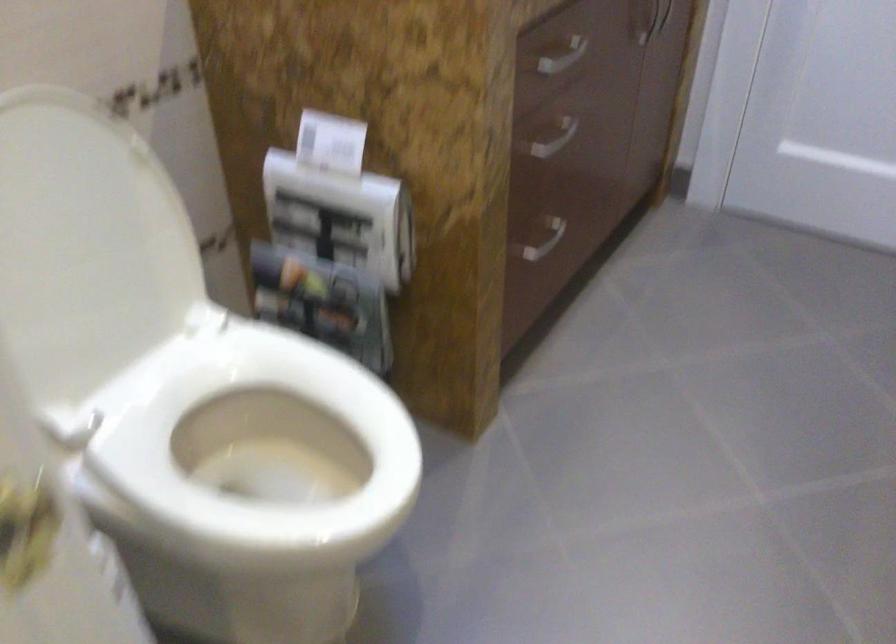
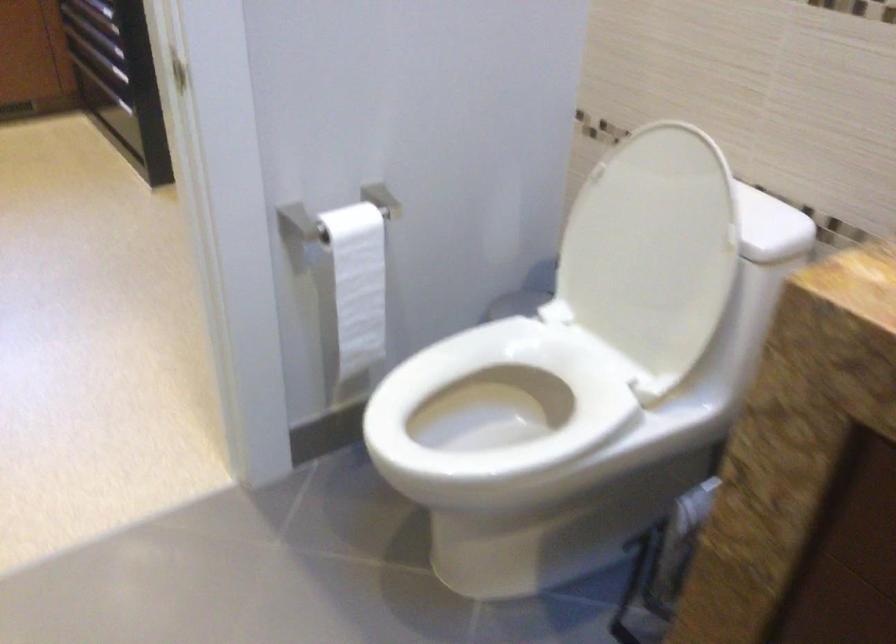
The point at (143, 556) is marked in the first image. Where is the corresponding point in the second image?

(497, 413)